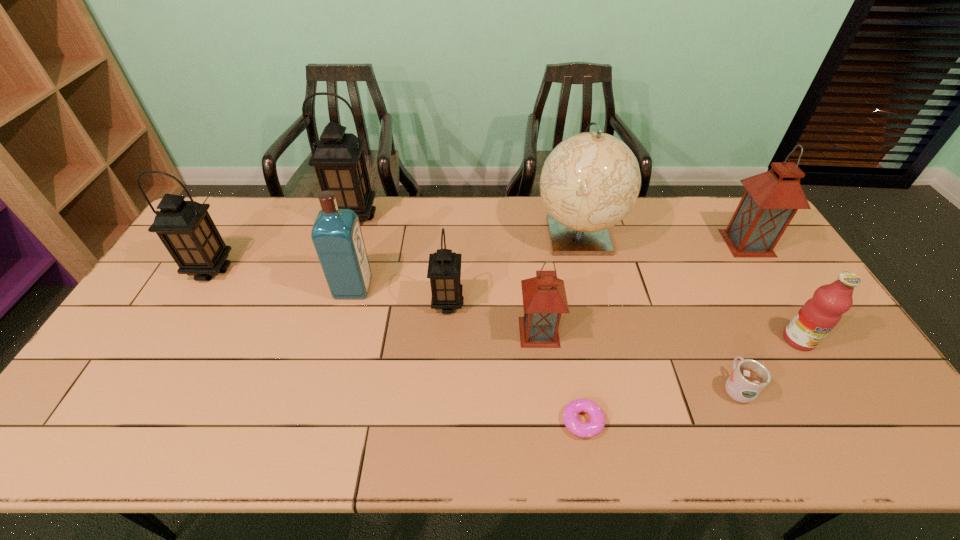
Where is `black lantern that is the second nearest to the doughnut`? Image resolution: width=960 pixels, height=540 pixels. black lantern that is the second nearest to the doughnut is located at coordinates (x=338, y=158).

Where is `the closest black lantern to the second black lantern from right to left`? The image size is (960, 540). the closest black lantern to the second black lantern from right to left is located at coordinates click(186, 229).

Identify the location of free region that satisfies the following two spatial constraints: 1. on the side with the handle of the second shortest object; 2. on the flat label side of the blue liquor. The image size is (960, 540). (691, 288).

The image size is (960, 540). What are the coordinates of `vacant space that satisfies the following two spatial constraints: 1. on the flat label side of the blue liquor; 2. on the left side of the smaller pink lantern` in the screenshot? It's located at (341, 332).

In order to click on free space that satisfies the following two spatial constraints: 1. on the side with the handle of the third object from right to left; 2. on the flat label side of the blue liquor in this screenshot , I will do coord(691,288).